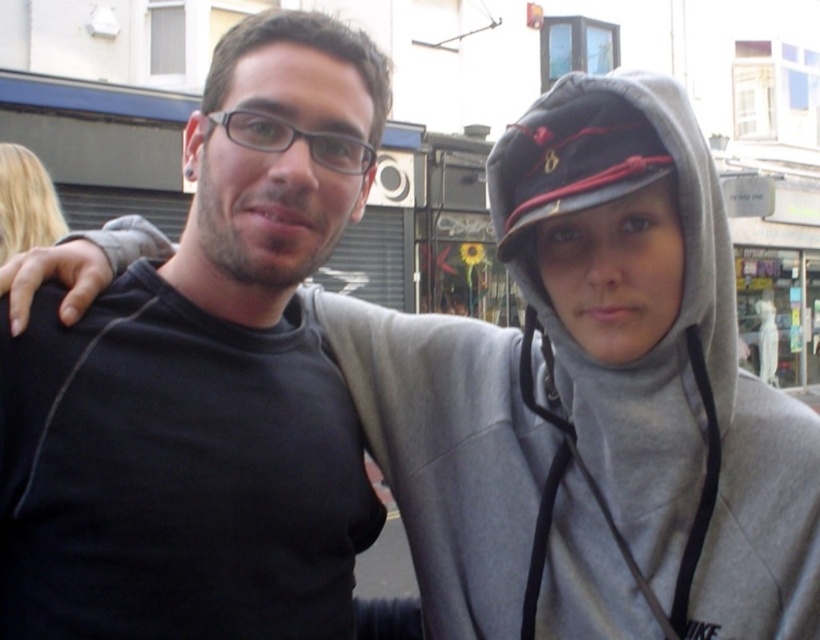
Is matte black shirt at center to the right of gray fleece hoodie at center from the viewer's perspective?

In fact, matte black shirt at center is to the left of gray fleece hoodie at center.

Is point (288, 432) more distant than point (623, 529)?

Yes, it is behind point (623, 529).

This screenshot has height=640, width=820. What are the coordinates of `matte black shirt at center` in the screenshot? It's located at (205, 381).